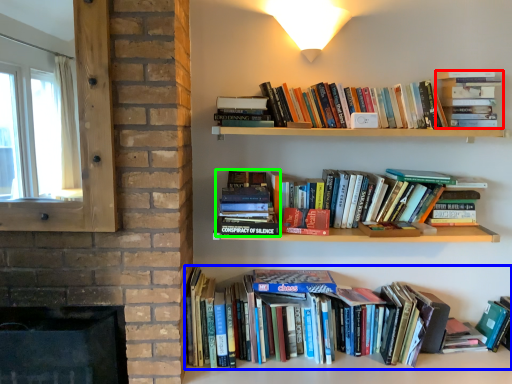
Question: Estimate the real-world distances between objects in this image. Which object is closer to book (highlighted by a red box), book (highlighted by a blue box) or book (highlighted by a green box)?

Choices:
 (A) book
 (B) book

Answer: (B)